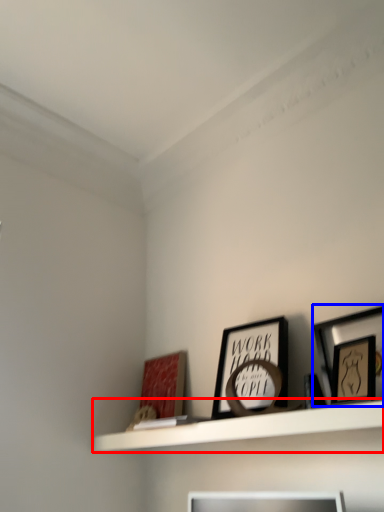
Question: Among these objects, which one is nearest to the camera, shelf (highlighted by a red box) or picture frame (highlighted by a blue box)?

Choices:
 (A) shelf
 (B) picture frame

Answer: (A)